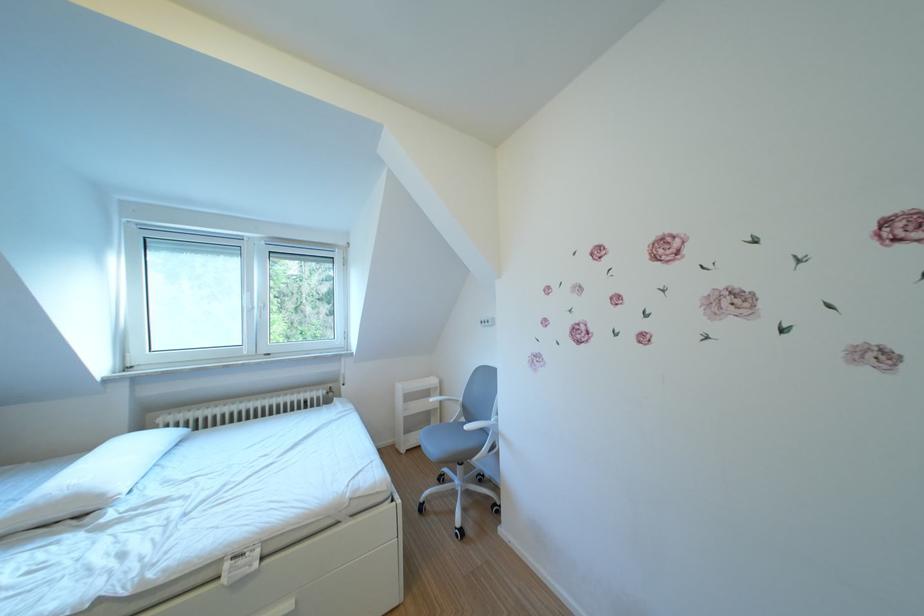
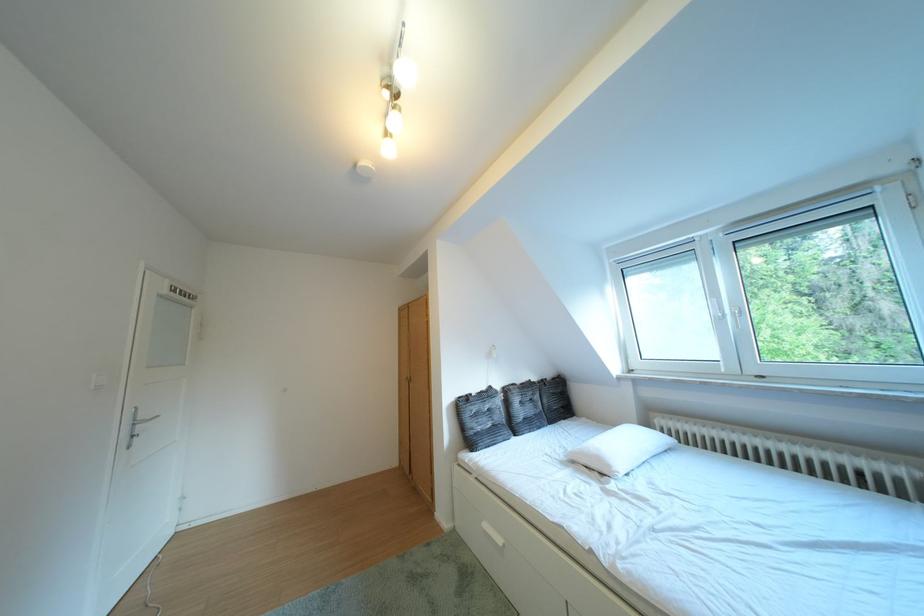
Question: The images are taken continuously from a first-person perspective. In which direction is your viewpoint rotating?

Choices:
 (A) Left
 (B) Right
 (C) Up
 (D) Down

Answer: (A)